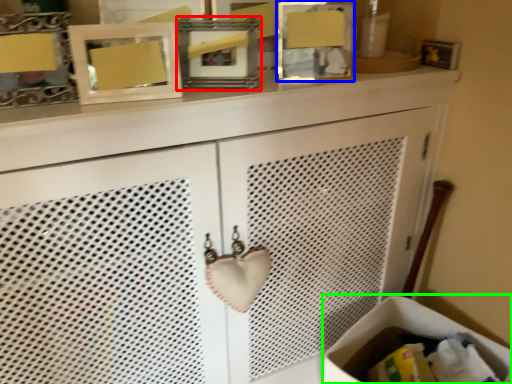
Question: Which object is positioned farthest from picture frame (highlighted by a red box)? Select from picture frame (highlighted by a blue box) and laundry basket (highlighted by a green box).

Choices:
 (A) picture frame
 (B) laundry basket

Answer: (B)